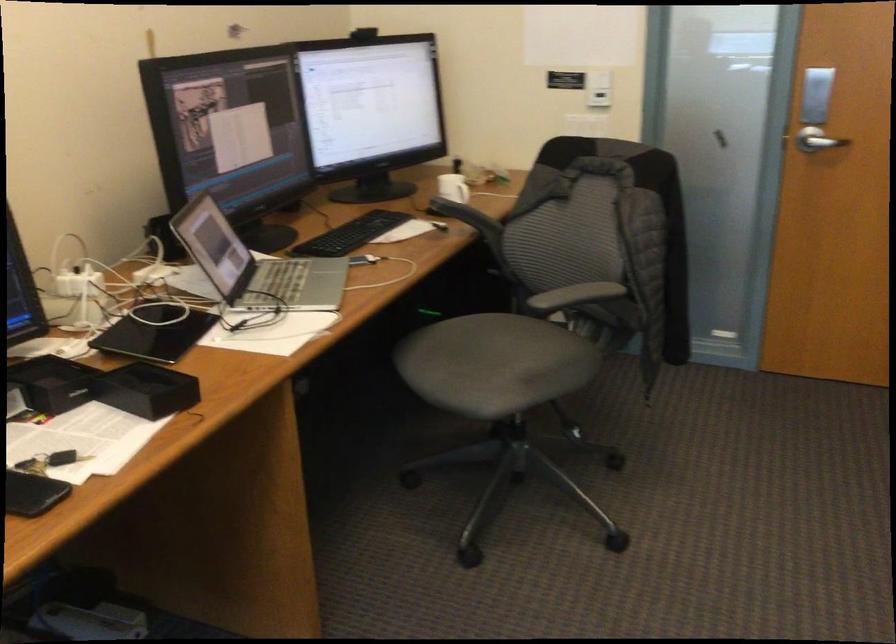
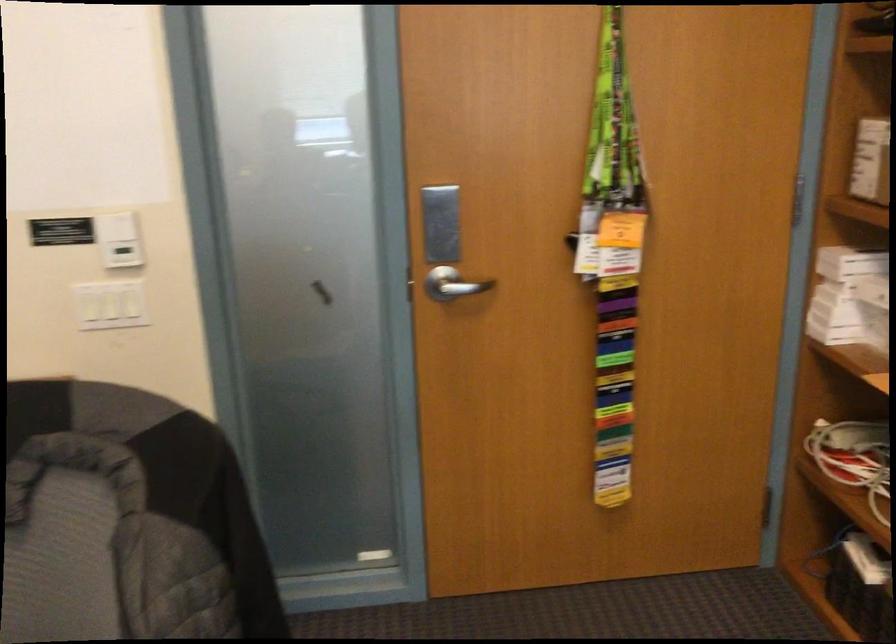
Which direction would the cameraman need to move to produce the second image?

The cameraman moved toward right, forward.